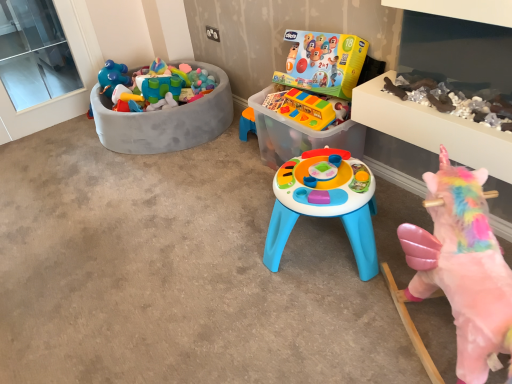
Question: From a real-world perspective, does translucent plastic toy at center, marked as the 2th toy in a right-to-left arrangement, sit lower than rubberized yellow toy bus at center, placed as the third toy when sorted from back to front?

Choices:
 (A) no
 (B) yes

Answer: (B)

Question: Would you say translucent plastic toy at center, arranged as the 3th toy when viewed from the front, contains rubberized yellow toy bus at center, which is counted as the 2th toy, starting from the left?

Choices:
 (A) yes
 (B) no

Answer: (A)

Question: Can you confirm if translucent plastic toy at center, arranged as the 2th toy when viewed from the back, is smaller than rubberized yellow toy bus at center, placed as the third toy when sorted from back to front?

Choices:
 (A) yes
 (B) no

Answer: (B)

Question: From the image's perspective, is translucent plastic toy at center, arranged as the 2th toy when viewed from the back, on rubberized yellow toy bus at center, the second toy positioned from the front?

Choices:
 (A) no
 (B) yes

Answer: (A)

Question: From the image's perspective, would you say translucent plastic toy at center, arranged as the 3th toy when viewed from the front, is shown under rubberized yellow toy bus at center, which appears as the third toy when viewed from the right?

Choices:
 (A) yes
 (B) no

Answer: (A)

Question: Does translucent plastic toy at center, arranged as the 3th toy when viewed from the front, have a lesser height compared to rubberized yellow toy bus at center, the second toy positioned from the front?

Choices:
 (A) no
 (B) yes

Answer: (A)

Question: Can you confirm if rubberized yellow toy bus at center, the second toy positioned from the front, is positioned to the left of transparent plastic toy box at center?

Choices:
 (A) no
 (B) yes

Answer: (A)

Question: Is rubberized yellow toy bus at center, which appears as the third toy when viewed from the right, in front of transparent plastic toy box at center?

Choices:
 (A) yes
 (B) no

Answer: (B)

Question: Does rubberized yellow toy bus at center, placed as the third toy when sorted from back to front, lie behind transparent plastic toy box at center?

Choices:
 (A) no
 (B) yes

Answer: (B)

Question: Is rubberized yellow toy bus at center, placed as the third toy when sorted from back to front, far away from transparent plastic toy box at center?

Choices:
 (A) yes
 (B) no

Answer: (B)

Question: Is rubberized yellow toy bus at center, which appears as the third toy when viewed from the right, smaller than transparent plastic toy box at center?

Choices:
 (A) no
 (B) yes

Answer: (B)

Question: From the image's perspective, is rubberized yellow toy bus at center, which appears as the third toy when viewed from the right, beneath transparent plastic toy box at center?

Choices:
 (A) no
 (B) yes

Answer: (A)

Question: Does plastic toy bin at left, positioned as the first toy in back-to-front order, have a lesser width compared to translucent plastic toy at center, marked as the third toy in a left-to-right arrangement?

Choices:
 (A) yes
 (B) no

Answer: (B)